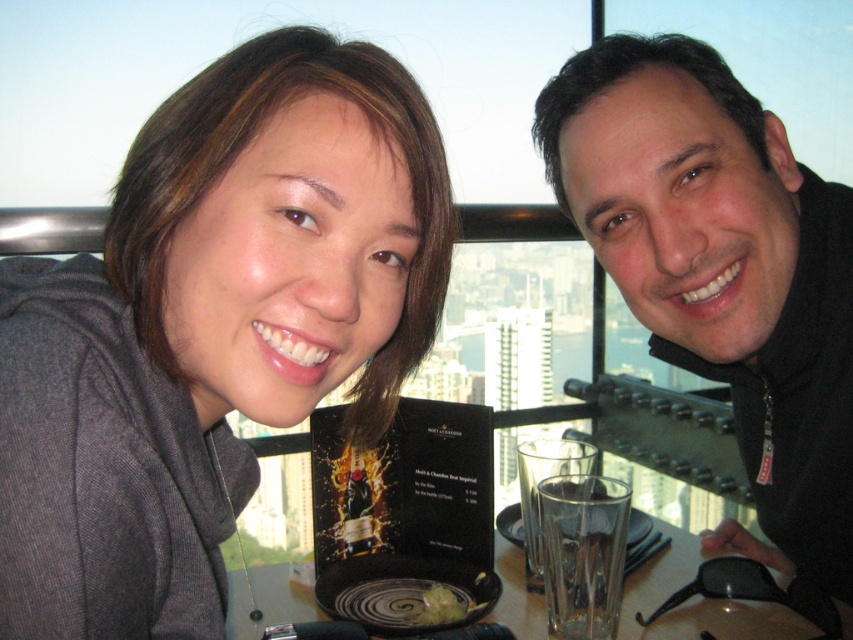
Between matte gray hoodie at left and translucent glass at center, which one appears on the left side from the viewer's perspective?

Positioned to the left is matte gray hoodie at left.

Does matte gray hoodie at left appear on the right side of translucent glass at center?

No, matte gray hoodie at left is not to the right of translucent glass at center.

What do you see at coordinates (212, 326) in the screenshot?
I see `matte gray hoodie at left` at bounding box center [212, 326].

The width and height of the screenshot is (853, 640). In order to click on matte gray hoodie at left in this screenshot , I will do `click(212, 326)`.

Is matte gray hoodie at left shorter than black matte jacket at upper right?

Correct, matte gray hoodie at left is not as tall as black matte jacket at upper right.

Can you confirm if matte gray hoodie at left is positioned above black matte jacket at upper right?

Actually, matte gray hoodie at left is below black matte jacket at upper right.

Between point (215, 160) and point (798, 380), which one is positioned behind?

Positioned behind is point (798, 380).

The height and width of the screenshot is (640, 853). I want to click on matte gray hoodie at left, so click(212, 326).

Is black matte jacket at upper right smaller than translucent glass at center?

No, black matte jacket at upper right is not smaller than translucent glass at center.

Which is more to the left, black matte jacket at upper right or translucent glass at center?

translucent glass at center is more to the left.

Is point (585, 108) more distant than point (669, 548)?

No.

Find the location of a particular element. This screenshot has width=853, height=640. black matte jacket at upper right is located at coordinates (721, 269).